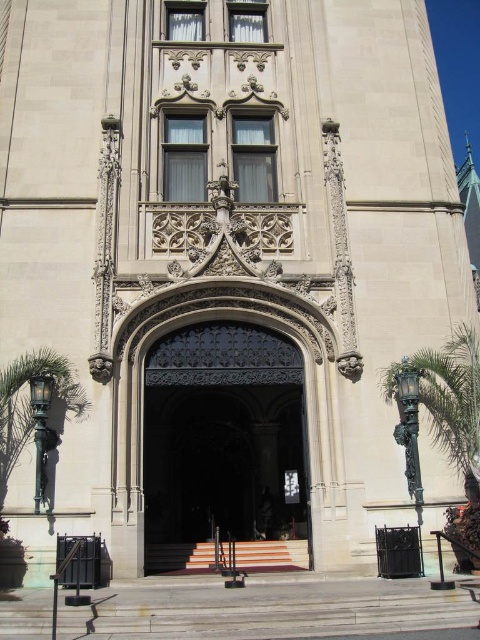
Find the location of `dark wrought iron gate at center`. dark wrought iron gate at center is located at coordinates click(222, 440).

Who is positioned more to the right, dark wrought iron gate at center or green leafy palm tree at lower left?

From the viewer's perspective, dark wrought iron gate at center appears more on the right side.

Measure the distance between dark wrought iron gate at center and camera.

dark wrought iron gate at center is 132.30 feet from camera.

Find the location of a particular element. dark wrought iron gate at center is located at coordinates (222, 440).

Who is shorter, green leafy palm tree at right or orange carpeted stairs at center?

orange carpeted stairs at center is shorter.

Does point (442, 380) come closer to viewer compared to point (222, 548)?

That is True.

Is point (457, 433) in front of point (219, 556)?

Yes, it is in front of point (219, 556).

Where is `green leafy palm tree at right`? The image size is (480, 640). green leafy palm tree at right is located at coordinates (452, 394).

Can you confirm if green leafy palm tree at lower left is positioned to the right of orange carpeted stairs at center?

In fact, green leafy palm tree at lower left is to the left of orange carpeted stairs at center.

From the picture: Between green leafy palm tree at lower left and orange carpeted stairs at center, which one is positioned higher?

green leafy palm tree at lower left

Which is behind, point (39, 376) or point (156, 545)?

Positioned behind is point (156, 545).

In order to click on green leafy palm tree at lower left in this screenshot , I will do `click(31, 403)`.